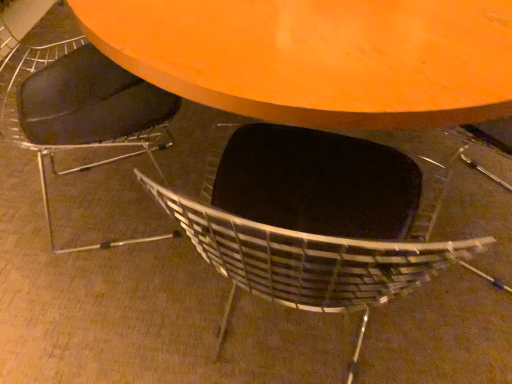
The height and width of the screenshot is (384, 512). What are the coordinates of `black leather chair at center, which is counted as the second chair, starting from the left` in the screenshot? It's located at (311, 234).

Measure the distance between black leather chair at center, the first chair in the right-to-left sequence, and camera.

The depth of black leather chair at center, the first chair in the right-to-left sequence, is 19.76 inches.

What do you see at coordinates (311, 234) in the screenshot? The width and height of the screenshot is (512, 384). I see `black leather chair at center, the first chair in the right-to-left sequence` at bounding box center [311, 234].

You are a GUI agent. You are given a task and a screenshot of the screen. Output one action in this format:
    pyautogui.click(x=<x>, y=<y>)
    Task: Click on the matte black chair at lower center, placed as the 1th chair when sorted from left to right
    
    Given the screenshot: What is the action you would take?
    pyautogui.click(x=80, y=110)

Describe the element at coordinates (80, 110) in the screenshot. I see `matte black chair at lower center, the 2th chair in the right-to-left sequence` at that location.

Find the location of `black leather chair at center, the first chair in the right-to-left sequence`. black leather chair at center, the first chair in the right-to-left sequence is located at coordinates (311, 234).

Consider the image. Which is more to the left, matte black chair at lower center, placed as the 1th chair when sorted from left to right, or black leather chair at center, the first chair in the right-to-left sequence?

matte black chair at lower center, placed as the 1th chair when sorted from left to right.

Who is more distant, matte black chair at lower center, the 2th chair in the right-to-left sequence, or black leather chair at center, which is counted as the second chair, starting from the left?

matte black chair at lower center, the 2th chair in the right-to-left sequence, is further from the camera.

Is point (38, 96) closer or farther from the camera than point (335, 293)?

Point (38, 96) is farther from the camera than point (335, 293).

From the image's perspective, is matte black chair at lower center, placed as the 1th chair when sorted from left to right, positioned above or below black leather chair at center, the first chair in the right-to-left sequence?

From the image's perspective, matte black chair at lower center, placed as the 1th chair when sorted from left to right, appears above black leather chair at center, the first chair in the right-to-left sequence.

From a real-world perspective, is matte black chair at lower center, placed as the 1th chair when sorted from left to right, physically above black leather chair at center, the first chair in the right-to-left sequence?

Yes, from a real-world perspective, matte black chair at lower center, placed as the 1th chair when sorted from left to right, is above black leather chair at center, the first chair in the right-to-left sequence.

In terms of width, does matte black chair at lower center, placed as the 1th chair when sorted from left to right, look wider or thinner when compared to black leather chair at center, which is counted as the second chair, starting from the left?

Considering their sizes, matte black chair at lower center, placed as the 1th chair when sorted from left to right, looks slimmer than black leather chair at center, which is counted as the second chair, starting from the left.

Between matte black chair at lower center, placed as the 1th chair when sorted from left to right, and black leather chair at center, which is counted as the second chair, starting from the left, which one has less height?

With less height is black leather chair at center, which is counted as the second chair, starting from the left.

Between matte black chair at lower center, the 2th chair in the right-to-left sequence, and black leather chair at center, which is counted as the second chair, starting from the left, which one has smaller size?

matte black chair at lower center, the 2th chair in the right-to-left sequence.

Is black leather chair at center, the first chair in the right-to-left sequence, located within matte black chair at lower center, the 2th chair in the right-to-left sequence?

No, black leather chair at center, the first chair in the right-to-left sequence, is located outside of matte black chair at lower center, the 2th chair in the right-to-left sequence.

Can you see matte black chair at lower center, the 2th chair in the right-to-left sequence, touching black leather chair at center, the first chair in the right-to-left sequence?

No, matte black chair at lower center, the 2th chair in the right-to-left sequence, is not touching black leather chair at center, the first chair in the right-to-left sequence.

Is matte black chair at lower center, placed as the 1th chair when sorted from left to right, turned away from black leather chair at center, which is counted as the second chair, starting from the left?

No.

Locate an element on the screen. chair in front of the matte black chair at lower center, the 2th chair in the right-to-left sequence is located at coordinates (311, 234).

Would you say black leather chair at center, the first chair in the right-to-left sequence, is to the left or to the right of matte black chair at lower center, placed as the 1th chair when sorted from left to right, in the picture?

Clearly, black leather chair at center, the first chair in the right-to-left sequence, is on the right of matte black chair at lower center, placed as the 1th chair when sorted from left to right, in the image.

Considering the positions of objects black leather chair at center, which is counted as the second chair, starting from the left, and matte black chair at lower center, the 2th chair in the right-to-left sequence, in the image provided, who is behind, black leather chair at center, which is counted as the second chair, starting from the left, or matte black chair at lower center, the 2th chair in the right-to-left sequence,?

Positioned behind is matte black chair at lower center, the 2th chair in the right-to-left sequence.

Is point (317, 267) more distant than point (101, 126)?

No, (317, 267) is closer to viewer.

From the image's perspective, who appears lower, black leather chair at center, which is counted as the second chair, starting from the left, or matte black chair at lower center, placed as the 1th chair when sorted from left to right?

black leather chair at center, which is counted as the second chair, starting from the left, is shown below in the image.

From a real-world perspective, which is physically above, black leather chair at center, which is counted as the second chair, starting from the left, or matte black chair at lower center, the 2th chair in the right-to-left sequence?

matte black chair at lower center, the 2th chair in the right-to-left sequence, is physically above.

Considering the sizes of objects black leather chair at center, the first chair in the right-to-left sequence, and matte black chair at lower center, the 2th chair in the right-to-left sequence, in the image provided, who is thinner, black leather chair at center, the first chair in the right-to-left sequence, or matte black chair at lower center, the 2th chair in the right-to-left sequence,?

With smaller width is matte black chair at lower center, the 2th chair in the right-to-left sequence.

In terms of height, does black leather chair at center, the first chair in the right-to-left sequence, look taller or shorter compared to matte black chair at lower center, placed as the 1th chair when sorted from left to right?

In the image, black leather chair at center, the first chair in the right-to-left sequence, appears to be shorter than matte black chair at lower center, placed as the 1th chair when sorted from left to right.

Does black leather chair at center, the first chair in the right-to-left sequence, have a larger size compared to matte black chair at lower center, placed as the 1th chair when sorted from left to right?

Correct, black leather chair at center, the first chair in the right-to-left sequence, is larger in size than matte black chair at lower center, placed as the 1th chair when sorted from left to right.

Is black leather chair at center, the first chair in the right-to-left sequence, not inside matte black chair at lower center, the 2th chair in the right-to-left sequence?

Yes, black leather chair at center, the first chair in the right-to-left sequence, is not within matte black chair at lower center, the 2th chair in the right-to-left sequence.

Consider the image. Is black leather chair at center, which is counted as the second chair, starting from the left, not close to matte black chair at lower center, the 2th chair in the right-to-left sequence?

No, black leather chair at center, which is counted as the second chair, starting from the left, is not far from matte black chair at lower center, the 2th chair in the right-to-left sequence.

Is black leather chair at center, the first chair in the right-to-left sequence, looking in the opposite direction of matte black chair at lower center, placed as the 1th chair when sorted from left to right?

No, black leather chair at center, the first chair in the right-to-left sequence,'s orientation is not away from matte black chair at lower center, placed as the 1th chair when sorted from left to right.

Can you tell me how much black leather chair at center, which is counted as the second chair, starting from the left, and matte black chair at lower center, placed as the 1th chair when sorted from left to right, differ in facing direction?

black leather chair at center, which is counted as the second chair, starting from the left, and matte black chair at lower center, placed as the 1th chair when sorted from left to right, are facing 63.7 degrees away from each other.

The width and height of the screenshot is (512, 384). Identify the location of chair above the black leather chair at center, the first chair in the right-to-left sequence (from the image's perspective). (80, 110).

Identify the location of chair that is behind the black leather chair at center, the first chair in the right-to-left sequence. (80, 110).

The height and width of the screenshot is (384, 512). In the image, there is a matte black chair at lower center, placed as the 1th chair when sorted from left to right. What are the coordinates of `chair below it (from a real-world perspective)` in the screenshot? It's located at (311, 234).